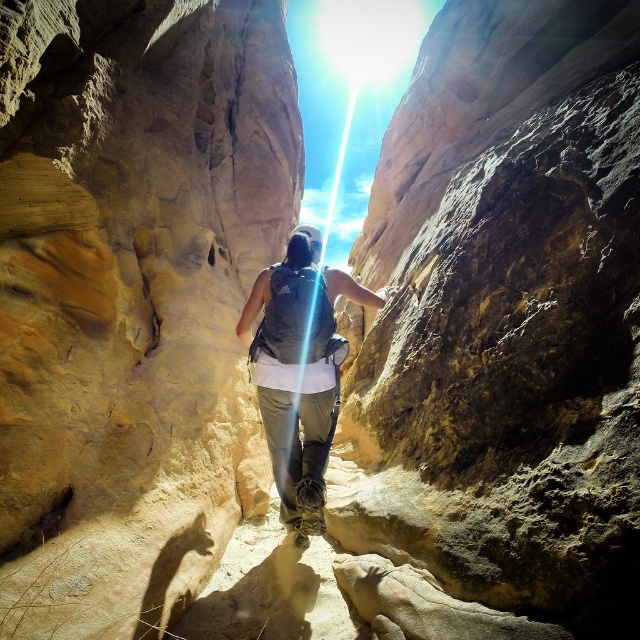
From the picture: Can you confirm if rustic sandstone boulder at center is positioned below matte gray backpack at center?

No.

Is point (508, 614) positioned after point (336, 285)?

No, (508, 614) is closer to viewer.

I want to click on rustic sandstone boulder at center, so click(500, 336).

Consider the image. Is yellow sandstone rock face at center positioned in front of matte gray backpack at center?

That is True.

Is point (22, 1) behind point (291, 358)?

No, (22, 1) is closer to viewer.

The height and width of the screenshot is (640, 640). Find the location of `yellow sandstone rock face at center`. yellow sandstone rock face at center is located at coordinates (131, 296).

How distant is rustic sandstone boulder at center from yellow sandstone rock face at center?

rustic sandstone boulder at center and yellow sandstone rock face at center are 5.42 meters apart from each other.

Locate an element on the screen. The width and height of the screenshot is (640, 640). rustic sandstone boulder at center is located at coordinates (500, 336).

Where is `rustic sandstone boulder at center`? rustic sandstone boulder at center is located at coordinates (500, 336).